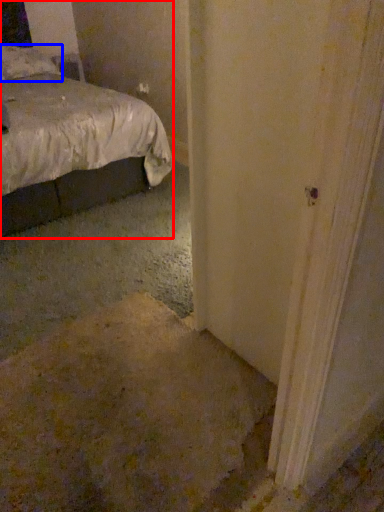
Question: Among these objects, which one is nearest to the camera, bed (highlighted by a red box) or pillow (highlighted by a blue box)?

Choices:
 (A) bed
 (B) pillow

Answer: (A)